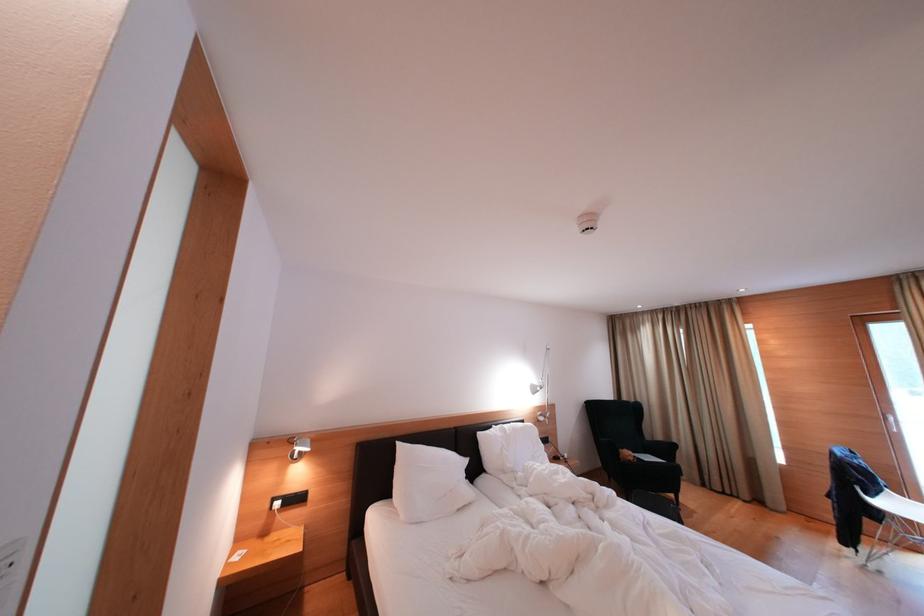
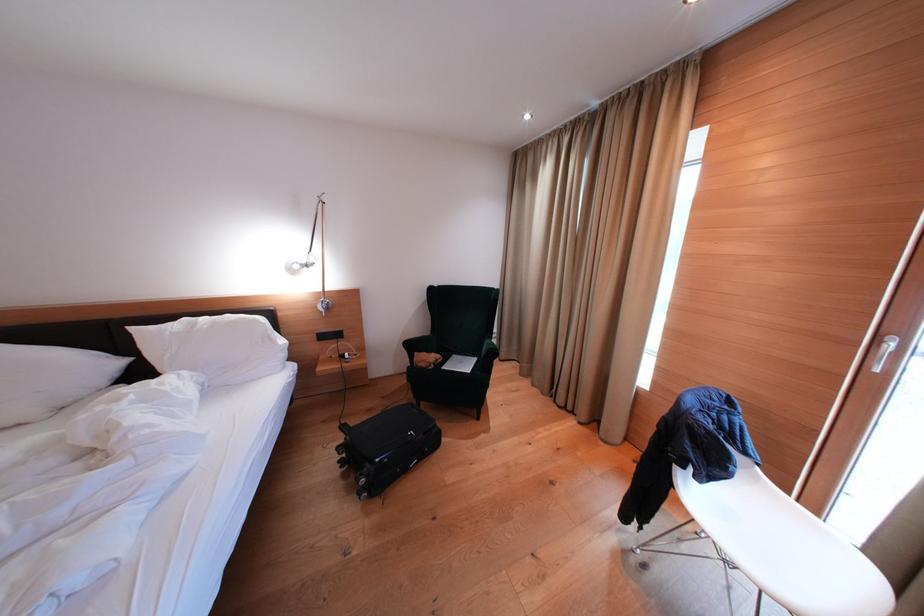
Which direction would the cameraman need to move to produce the second image?

The cameraman moved toward right, forward.